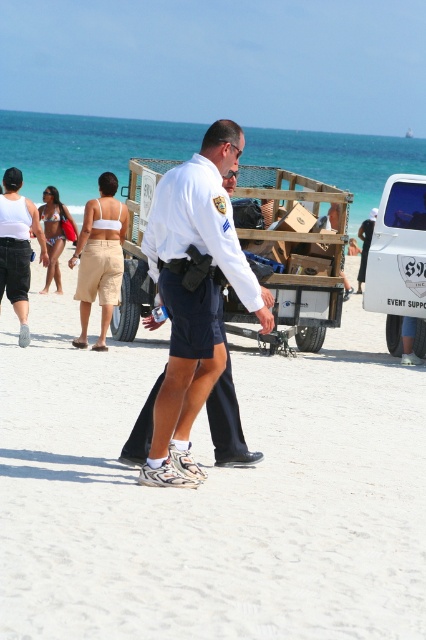
Consider the image. Between white matte uniform at center and white uniform at center, which one has more height?

Standing taller between the two is white uniform at center.

Who is lower down, white matte uniform at center or white uniform at center?

white matte uniform at center is lower down.

This screenshot has height=640, width=426. What do you see at coordinates (210, 492) in the screenshot?
I see `white matte uniform at center` at bounding box center [210, 492].

Identify the location of white matte uniform at center. (210, 492).

Between white uniform at center and white matte van at right, which one appears on the right side from the viewer's perspective?

white matte van at right

Between point (184, 252) and point (400, 285), which one is positioned behind?

The point (400, 285) is behind.

Is point (236, 237) behind point (397, 262)?

No, (236, 237) is closer to viewer.

Where is `white uniform at center`? The image size is (426, 640). white uniform at center is located at coordinates (193, 294).

Does white matte uniform at center have a greater width compared to white matte van at right?

Yes, white matte uniform at center is wider than white matte van at right.

In the scene shown: Can you confirm if white matte uniform at center is thinner than white matte van at right?

In fact, white matte uniform at center might be wider than white matte van at right.

I want to click on white matte uniform at center, so click(x=210, y=492).